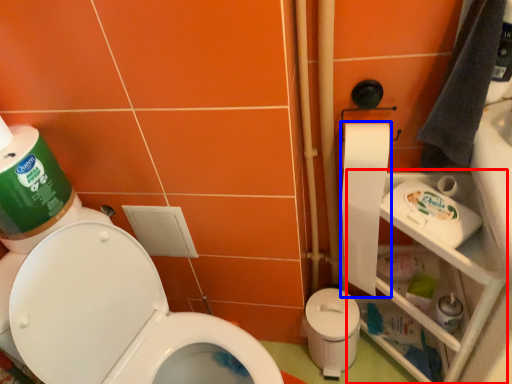
Question: Which of the following is the closest to the observer, shelf (highlighted by a red box) or toilet paper (highlighted by a blue box)?

Choices:
 (A) shelf
 (B) toilet paper

Answer: (A)